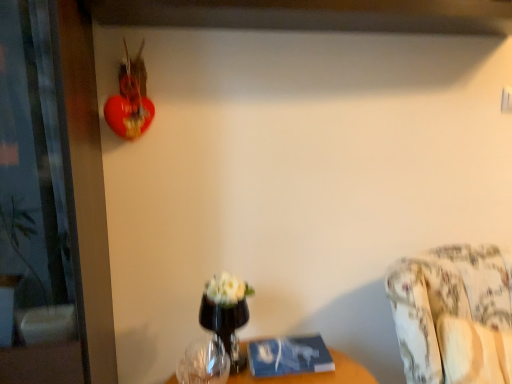
Question: Based on their positions, is floral fabric couch at lower right located to the left or right of transparent glass vase at center?

Choices:
 (A) right
 (B) left

Answer: (A)

Question: Do you think floral fabric couch at lower right is within transparent glass vase at center, or outside of it?

Choices:
 (A) inside
 (B) outside

Answer: (B)

Question: Estimate the real-world distances between objects in this image. Which object is closer to the transparent glass screen door at left?

Choices:
 (A) transparent glass vase at center
 (B) floral fabric couch at lower right
 (C) transparent glass vase at lower center

Answer: (A)

Question: Which object is the farthest from the floral fabric couch at lower right?

Choices:
 (A) transparent glass vase at center
 (B) transparent glass screen door at left
 (C) transparent glass vase at lower center

Answer: (B)